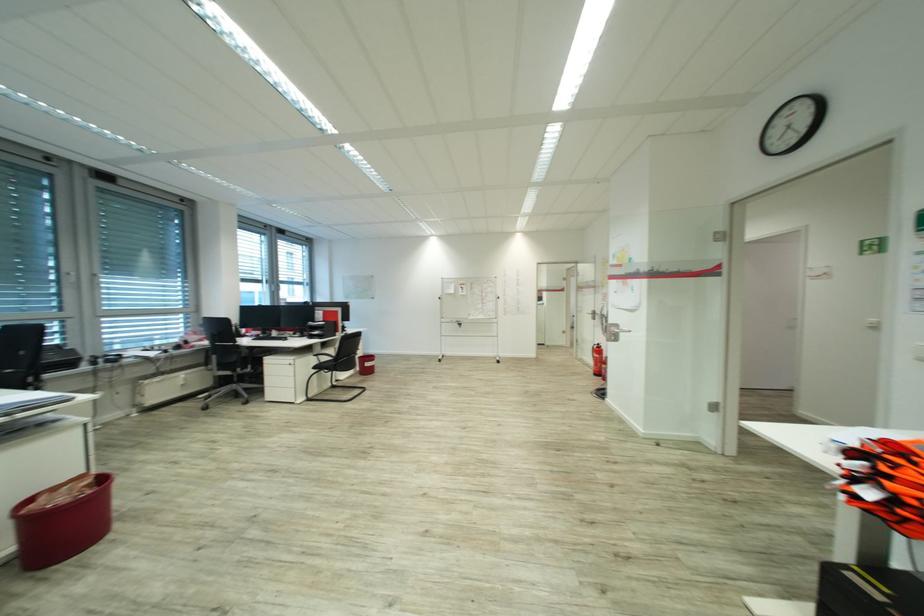
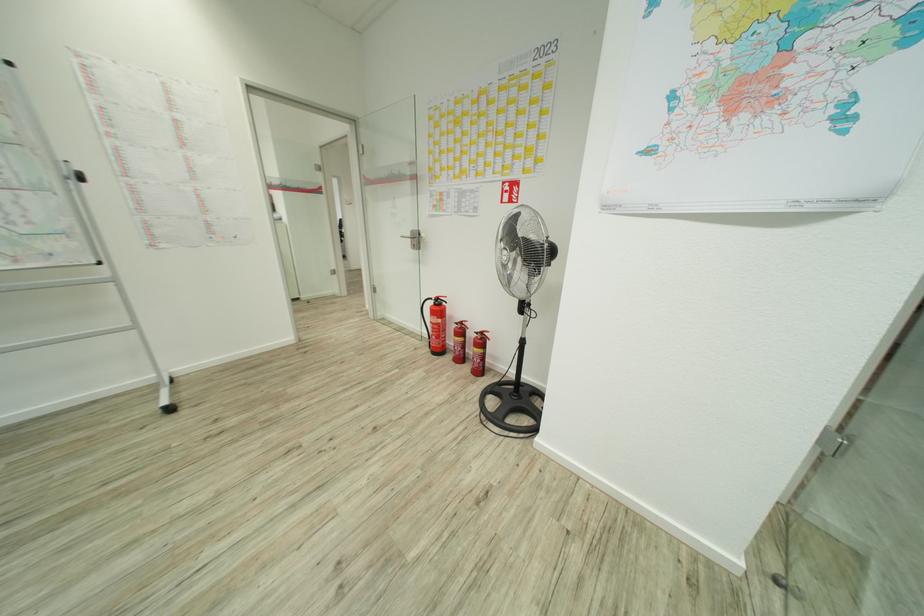
Find the pixel in the second image that matches the point at 496,361 in the first image.

(169, 408)